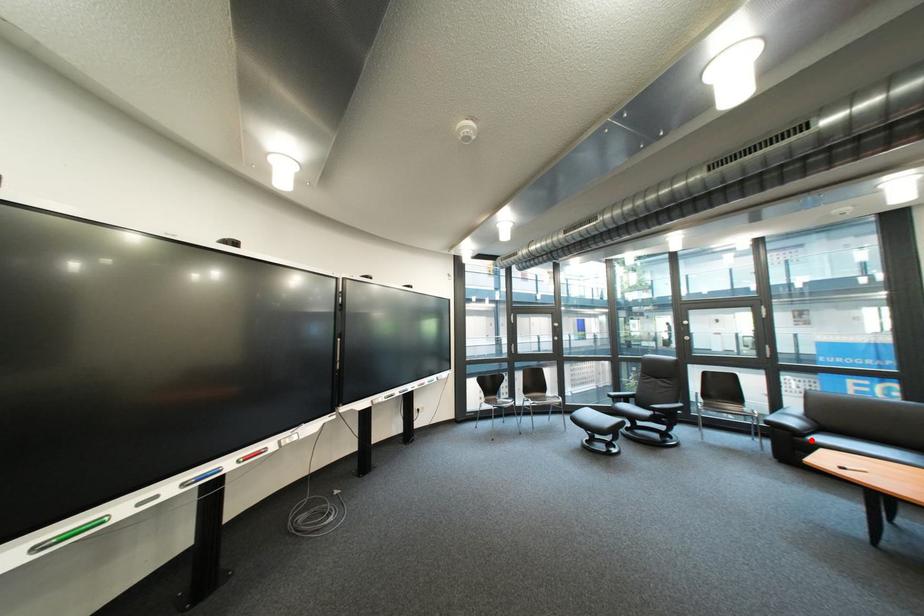
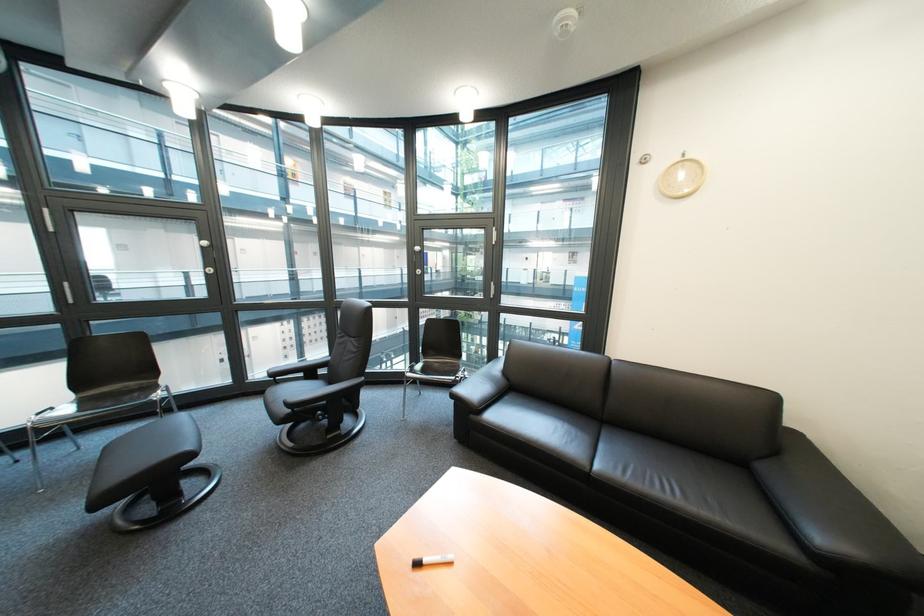
In the second image, find the point that corresponds to the highlighted location in the first image.

(485, 418)